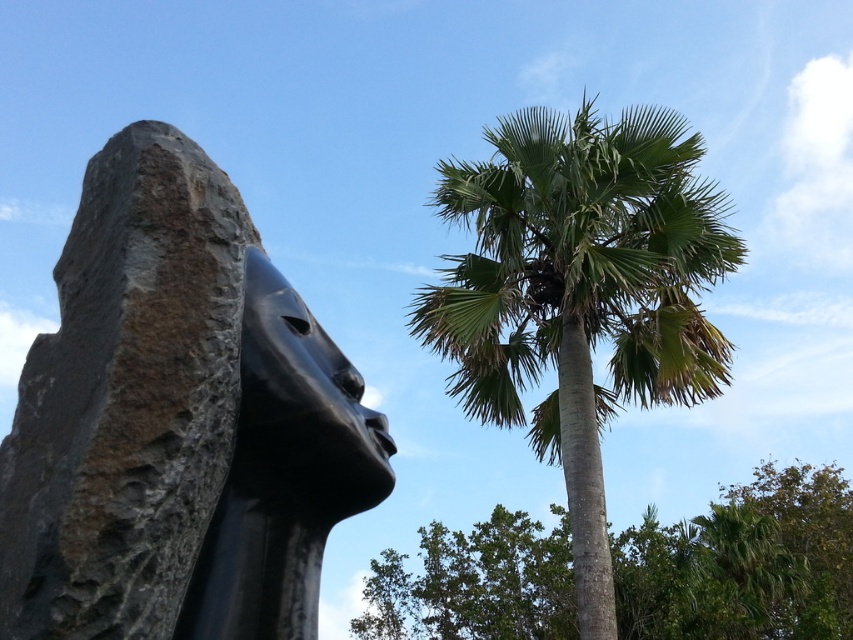
Can you confirm if green leafy palm at upper right is positioned above black glossy statue at center?

Indeed, green leafy palm at upper right is positioned over black glossy statue at center.

Is point (482, 412) closer to camera compared to point (277, 353)?

No.

Where is `green leafy palm at upper right`? This screenshot has height=640, width=853. green leafy palm at upper right is located at coordinates (579, 292).

Is black polished stone sculpture at center further to the viewer compared to green leafy palm at upper right?

No, black polished stone sculpture at center is in front of green leafy palm at upper right.

Can you confirm if black polished stone sculpture at center is smaller than green leafy palm at upper right?

Incorrect, black polished stone sculpture at center is not smaller in size than green leafy palm at upper right.

Does point (132, 230) come in front of point (630, 253)?

Yes, it is.

You are a GUI agent. You are given a task and a screenshot of the screen. Output one action in this format:
    pyautogui.click(x=<x>, y=<y>)
    Task: Click on the black polished stone sculpture at center
    The height and width of the screenshot is (640, 853).
    Given the screenshot: What is the action you would take?
    pyautogui.click(x=177, y=420)

Does black polished stone sculpture at center appear on the left side of black glossy statue at center?

Yes, black polished stone sculpture at center is to the left of black glossy statue at center.

The height and width of the screenshot is (640, 853). What do you see at coordinates (177, 420) in the screenshot? I see `black polished stone sculpture at center` at bounding box center [177, 420].

Is point (189, 534) closer to viewer compared to point (291, 500)?

Yes, it is in front of point (291, 500).

Locate an element on the screen. black polished stone sculpture at center is located at coordinates (177, 420).